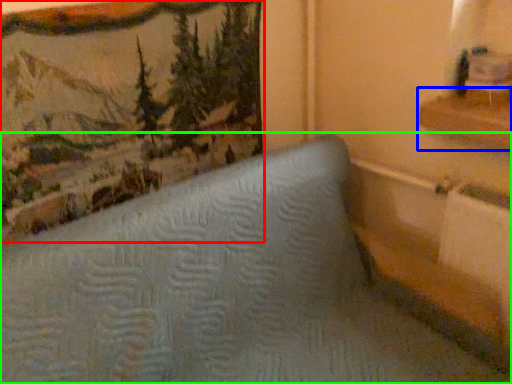
Question: Based on their relative distances, which object is farther from picture frame (highlighted by a red box)? Choose from shelf (highlighted by a blue box) and furniture (highlighted by a green box).

Choices:
 (A) shelf
 (B) furniture

Answer: (A)